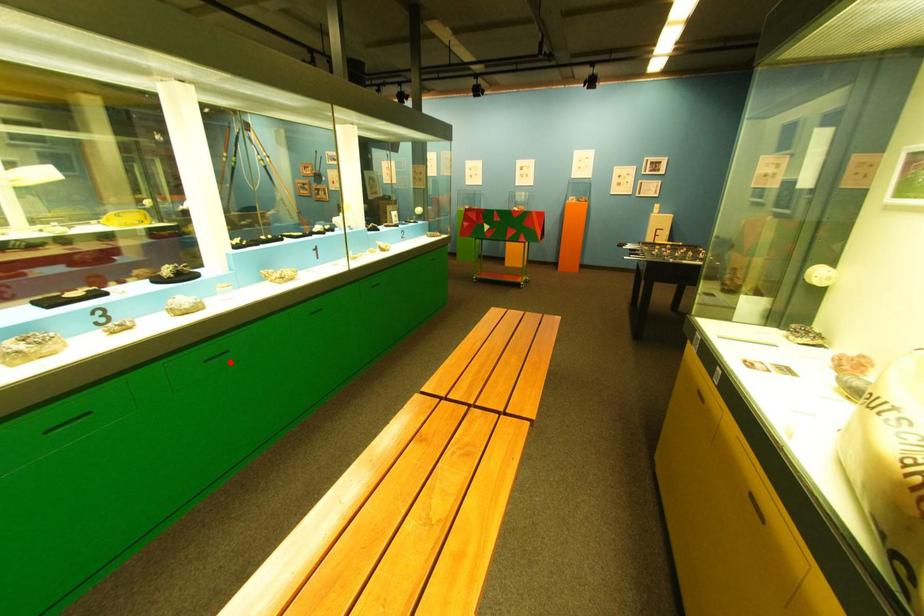
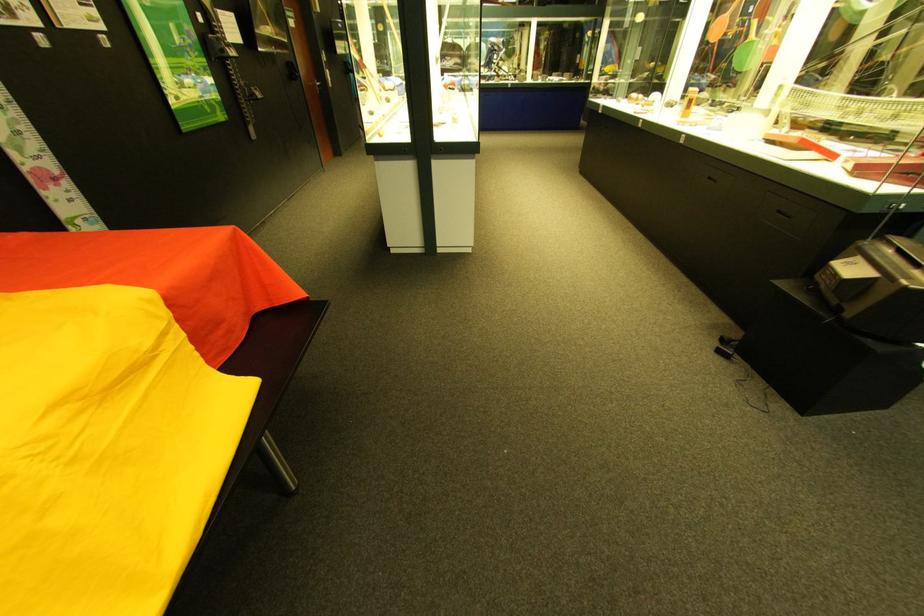
Question: I am providing you with two images of the same scene from different viewpoints. A red point is marked on the first image. Can you still see the location of the red point in image 2?

Choices:
 (A) Yes
 (B) No

Answer: (B)